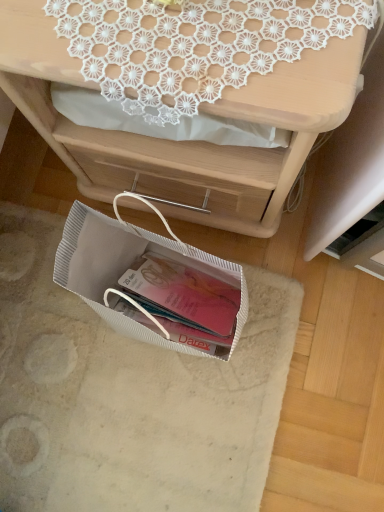
Describe the element at coordinates (129, 395) in the screenshot. Image resolution: width=384 pixels, height=512 pixels. I see `white textured bag at lower center` at that location.

You are a GUI agent. You are given a task and a screenshot of the screen. Output one action in this format:
    pyautogui.click(x=<x>, y=<y>)
    Task: Click on the white lace doily at upper center
    The height and width of the screenshot is (512, 384).
    Given the screenshot: What is the action you would take?
    pyautogui.click(x=194, y=46)

I want to click on white textured bag at lower center, so pos(129,395).

Does white textured bag at lower center turn towards matte white desk at upper center?

No, white textured bag at lower center is not facing towards matte white desk at upper center.

From a real-world perspective, is white textured bag at lower center physically located above or below matte white desk at upper center?

white textured bag at lower center is situated lower than matte white desk at upper center in the real world.

Would you consider white textured bag at lower center to be distant from matte white desk at upper center?

No.

Locate an element on the screen. lace positioned vertically above the white textured bag at lower center (from a real-world perspective) is located at coordinates (194, 46).

Looking at this image, would you say white textured bag at lower center is a long distance from white lace doily at upper center?

Actually, white textured bag at lower center and white lace doily at upper center are a little close together.

Who is more distant, white textured bag at lower center or white lace doily at upper center?

white textured bag at lower center is behind.

From a real-world perspective, is white textured bag at lower center physically below white lace doily at upper center?

Yes.

How many degrees apart are the facing directions of white lace doily at upper center and matte white desk at upper center?

50.9 degrees.

Are white lace doily at upper center and matte white desk at upper center making contact?

No, white lace doily at upper center is not next to matte white desk at upper center.

Does white lace doily at upper center have a greater width compared to matte white desk at upper center?

In fact, white lace doily at upper center might be narrower than matte white desk at upper center.

What are the coordinates of `lace above the matte white desk at upper center (from a real-world perspective)` in the screenshot? It's located at pos(194,46).

Is matte white desk at upper center aimed at white textured bag at lower center?

Yes, matte white desk at upper center is facing white textured bag at lower center.

Is matte white desk at upper center wider or thinner than white textured bag at lower center?

matte white desk at upper center is thinner than white textured bag at lower center.

Can you tell me how much matte white desk at upper center and white textured bag at lower center differ in facing direction?

They differ by 89.8 degrees in their facing directions.

Which is more to the left, matte white desk at upper center or white textured bag at lower center?

Positioned to the left is white textured bag at lower center.

Is matte white desk at upper center taller or shorter than white lace doily at upper center?

In the image, matte white desk at upper center appears to be taller than white lace doily at upper center.

Considering the sizes of objects matte white desk at upper center and white lace doily at upper center in the image provided, who is thinner, matte white desk at upper center or white lace doily at upper center?

white lace doily at upper center.

Is white lace doily at upper center inside matte white desk at upper center?

Yes, white lace doily at upper center can be found within matte white desk at upper center.

Is matte white desk at upper center in contact with white lace doily at upper center?

There is a gap between matte white desk at upper center and white lace doily at upper center.

How many degrees apart are the facing directions of white lace doily at upper center and white textured bag at lower center?

The facing directions of white lace doily at upper center and white textured bag at lower center are 141 degrees apart.

Between white lace doily at upper center and white textured bag at lower center, which one appears on the right side from the viewer's perspective?

From the viewer's perspective, white lace doily at upper center appears more on the right side.

Which of these two, white lace doily at upper center or white textured bag at lower center, stands taller?

white lace doily at upper center is taller.

Looking at this image, can you confirm if white lace doily at upper center is thinner than white textured bag at lower center?

Yes, white lace doily at upper center is thinner than white textured bag at lower center.

Find the location of a particular element. This screenshot has width=384, height=512. desk above the white textured bag at lower center (from the image's perspective) is located at coordinates (189, 95).

Identify the location of place mat below the white lace doily at upper center (from a real-world perspective). The width and height of the screenshot is (384, 512). (129, 395).

Considering their positions, is white textured bag at lower center positioned closer to matte white desk at upper center than white lace doily at upper center?

white lace doily at upper center.

When comparing their distances from white textured bag at lower center, does matte white desk at upper center or white lace doily at upper center seem further?

white lace doily at upper center lies further to white textured bag at lower center than the other object.

Which object lies nearer to the anchor point matte white desk at upper center, white lace doily at upper center or white textured bag at lower center?

Based on the image, white lace doily at upper center appears to be nearer to matte white desk at upper center.

Estimate the real-world distances between objects in this image. Which object is further from white lace doily at upper center, matte white desk at upper center or white textured bag at lower center?

white textured bag at lower center lies further to white lace doily at upper center than the other object.

From the image, which object appears to be nearer to white textured bag at lower center, white lace doily at upper center or matte white desk at upper center?

matte white desk at upper center is closer to white textured bag at lower center.

Based on their spatial positions, is white textured bag at lower center or matte white desk at upper center closer to white lace doily at upper center?

matte white desk at upper center is closer to white lace doily at upper center.

Find the location of a particular element. desk between white lace doily at upper center and white textured bag at lower center from top to bottom is located at coordinates (189, 95).